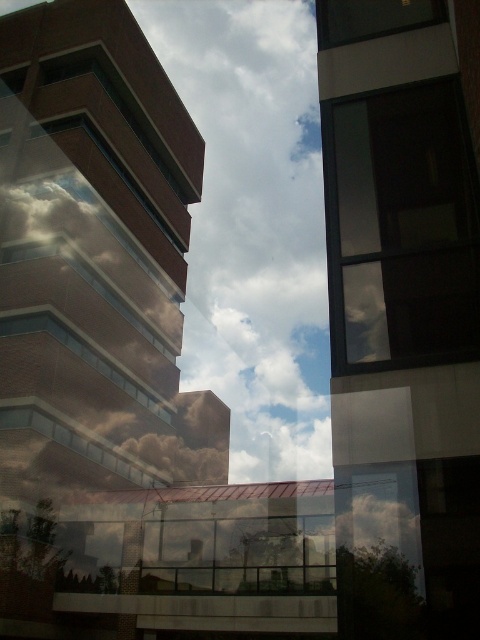
Question: Which point is closer to the camera taking this photo?

Choices:
 (A) (244, 413)
 (B) (370, 115)

Answer: (B)

Question: Can you confirm if white fluffy cloud at center is positioned to the right of transparent glass window at upper right?

Choices:
 (A) yes
 (B) no

Answer: (B)

Question: Can you confirm if white fluffy cloud at center is bigger than transparent glass window at upper right?

Choices:
 (A) yes
 (B) no

Answer: (A)

Question: Which point is farther to the camera?

Choices:
 (A) [x=200, y=316]
 (B) [x=446, y=134]

Answer: (A)

Question: Considering the relative positions of white fluffy cloud at center and transparent glass window at upper right in the image provided, where is white fluffy cloud at center located with respect to transparent glass window at upper right?

Choices:
 (A) right
 (B) left

Answer: (B)